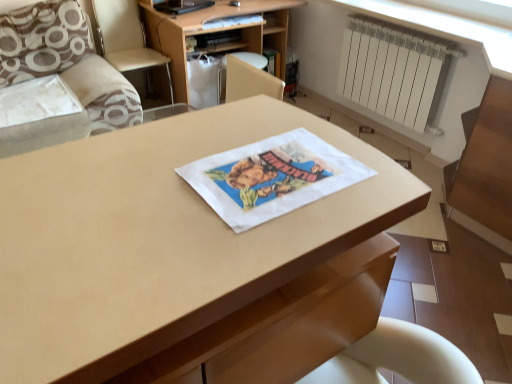
Describe the element at coordinates (284, 325) in the screenshot. The height and width of the screenshot is (384, 512). I see `wooden drawer at lower center` at that location.

The width and height of the screenshot is (512, 384). What are the coordinates of `beige fabric armchair at left` in the screenshot? It's located at (126, 38).

The height and width of the screenshot is (384, 512). What do you see at coordinates (153, 234) in the screenshot?
I see `matte wood desk at center` at bounding box center [153, 234].

Image resolution: width=512 pixels, height=384 pixels. Identify the location of white matte radiator at upper right. (394, 70).

How many degrees apart are the facing directions of wooden at upper center and matte wood desk at center?

The angular difference between wooden at upper center and matte wood desk at center is 177 degrees.

Is wooden at upper center facing towards matte wood desk at center?

Yes, wooden at upper center faces towards matte wood desk at center.

At what (x,y) coordinates should I click in order to perform the action: click on desk above the wooden at upper center (from a real-world perspective). Please return your answer as a coordinate pair (x, y). The image size is (512, 384). Looking at the image, I should click on (153, 234).

From a real-world perspective, which object rests below the other?

wooden at upper center is physically lower.

You are a GUI agent. You are given a task and a screenshot of the screen. Output one action in this format:
    pyautogui.click(x=<x>, y=<y>)
    Task: Click on the radiator behind the wooden drawer at lower center
    The image size is (512, 384).
    Given the screenshot: What is the action you would take?
    pyautogui.click(x=394, y=70)

Is white matte radiator at upper right far from wooden drawer at lower center?

That's right, there is a large distance between white matte radiator at upper right and wooden drawer at lower center.

From a real-world perspective, is white matte radiator at upper right beneath wooden drawer at lower center?

Yes, from a real-world perspective, white matte radiator at upper right is below wooden drawer at lower center.

Does white matte radiator at upper right have a larger size compared to wooden drawer at lower center?

Actually, white matte radiator at upper right might be smaller than wooden drawer at lower center.

Who is smaller, white matte radiator at upper right or wooden at upper center?

Smaller between the two is white matte radiator at upper right.

Is white matte radiator at upper right facing away from wooden at upper center?

No, white matte radiator at upper right's orientation is not away from wooden at upper center.

Which of these two, white matte radiator at upper right or wooden at upper center, is thinner?

With smaller width is white matte radiator at upper right.

Which is in front, point (422, 116) or point (165, 95)?

The point (422, 116) is in front.

Are beige fabric armchair at left and wooden at upper center far apart?

beige fabric armchair at left is near wooden at upper center, not far away.

Is beige fabric armchair at left turned away from wooden at upper center?

No, beige fabric armchair at left is not facing away from wooden at upper center.

Is point (139, 18) closer to viewer compared to point (187, 22)?

No, it is behind (187, 22).

Measure the distance between beige fabric armchair at left and wooden at upper center.

beige fabric armchair at left is 34.83 centimeters away from wooden at upper center.

Who is shorter, brown fabric couch at upper left or matte wood desk at center?

With less height is brown fabric couch at upper left.

Which of these two, brown fabric couch at upper left or matte wood desk at center, is bigger?

brown fabric couch at upper left is bigger.

Visually, is brown fabric couch at upper left positioned to the left or to the right of matte wood desk at center?

From the image, it's evident that brown fabric couch at upper left is to the left of matte wood desk at center.

Is brown fabric couch at upper left oriented away from matte wood desk at center?

No, brown fabric couch at upper left's orientation is not away from matte wood desk at center.

Is brown fabric couch at upper left shorter than beige fabric armchair at left?

Yes.

Considering the sizes of objects brown fabric couch at upper left and beige fabric armchair at left in the image provided, who is wider, brown fabric couch at upper left or beige fabric armchair at left?

Wider between the two is brown fabric couch at upper left.

Which object is closer to the camera taking this photo, brown fabric couch at upper left or beige fabric armchair at left?

brown fabric couch at upper left is closer to the camera.

From the image's perspective, does brown fabric couch at upper left appear lower than beige fabric armchair at left?

Indeed, from the image's perspective, brown fabric couch at upper left is shown beneath beige fabric armchair at left.

Would you consider white matte radiator at upper right to be distant from brown textured pillow at upper left?

That's right, there is a large distance between white matte radiator at upper right and brown textured pillow at upper left.

Is white matte radiator at upper right at the left side of brown textured pillow at upper left?

In fact, white matte radiator at upper right is to the right of brown textured pillow at upper left.

From the image's perspective, which one is positioned lower, white matte radiator at upper right or brown textured pillow at upper left?

white matte radiator at upper right.

At what (x,y) coordinates should I click in order to perform the action: click on desk lying on the right of wooden at upper center. Please return your answer as a coordinate pair (x, y). The height and width of the screenshot is (384, 512). Looking at the image, I should click on (153, 234).

Locate an element on the screen. The width and height of the screenshot is (512, 384). radiator that appears below the wooden drawer at lower center (from a real-world perspective) is located at coordinates pos(394,70).

Estimate the real-world distances between objects in this image. Which object is closer to beige fabric armchair at left, white matte radiator at upper right or brown fabric couch at upper left?

brown fabric couch at upper left is positioned closer to the anchor beige fabric armchair at left.

Considering their positions, is beige fabric armchair at left positioned closer to matte wood desk at center than wooden at upper center?

beige fabric armchair at left.

When comparing their distances from brown fabric couch at upper left, does brown textured pillow at upper left or white matte radiator at upper right seem further?

white matte radiator at upper right lies further to brown fabric couch at upper left than the other object.

Considering their positions, is white matte radiator at upper right positioned closer to wooden drawer at lower center than beige fabric armchair at left?

white matte radiator at upper right lies closer to wooden drawer at lower center than the other object.

When comparing their distances from beige fabric armchair at left, does white matte radiator at upper right or wooden at upper center seem closer?

wooden at upper center is positioned closer to the anchor beige fabric armchair at left.

Looking at this image, estimate the real-world distances between objects in this image. Which object is further from white matte radiator at upper right, wooden drawer at lower center or brown textured pillow at upper left?

The object further to white matte radiator at upper right is wooden drawer at lower center.

Estimate the real-world distances between objects in this image. Which object is further from beige fabric armchair at left, matte wood desk at center or wooden at upper center?

matte wood desk at center is further to beige fabric armchair at left.

Considering their positions, is beige fabric armchair at left positioned further to brown fabric couch at upper left than wooden drawer at lower center?

wooden drawer at lower center.

You are a GUI agent. You are given a task and a screenshot of the screen. Output one action in this format:
    pyautogui.click(x=<x>, y=<y>)
    Task: Click on the shelf located between brown fabric couch at upper left and white matte radiator at upper right in the left-right direction
    Image resolution: width=512 pixels, height=384 pixels.
    Given the screenshot: What is the action you would take?
    pyautogui.click(x=216, y=34)

Locate an element on the screen. The width and height of the screenshot is (512, 384). radiator between wooden drawer at lower center and wooden at upper center along the z-axis is located at coordinates (394, 70).

Find the location of a particular element. radiator between matte wood desk at center and beige fabric armchair at left in the front-back direction is located at coordinates (394, 70).

Where is `armchair between brown textured pillow at upper left and white matte radiator at upper right from left to right`? armchair between brown textured pillow at upper left and white matte radiator at upper right from left to right is located at coordinates (126, 38).